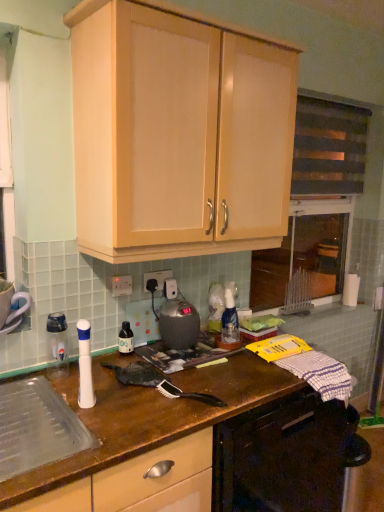
Where is `free space in front of metallic gray kettle at center`? This screenshot has width=384, height=512. free space in front of metallic gray kettle at center is located at coordinates (176, 356).